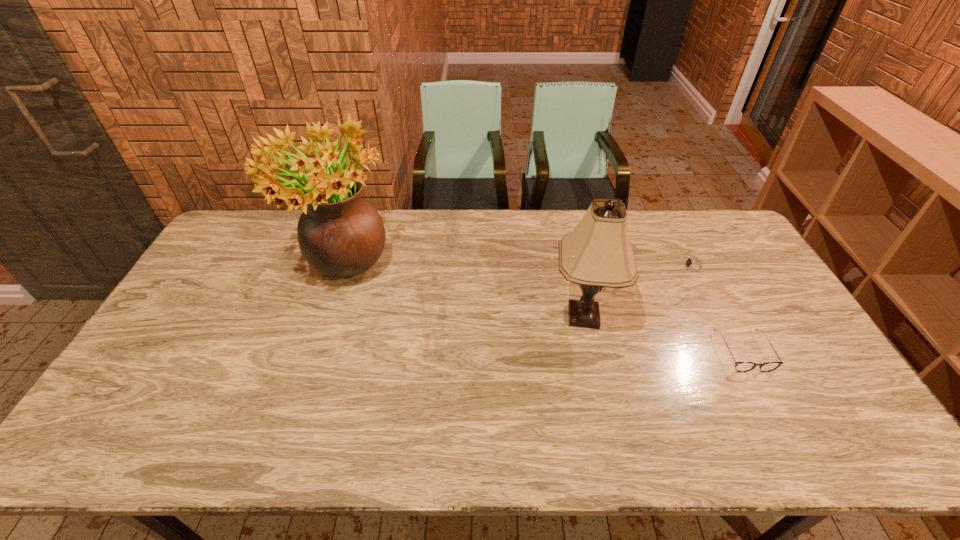
Locate an element on the screen. vacant space that satisfies the following two spatial constraints: 1. on the face of the watch; 2. on the front side of the flower arrangement is located at coordinates (697, 272).

Image resolution: width=960 pixels, height=540 pixels. I want to click on vacant region that satisfies the following two spatial constraints: 1. on the face of the watch; 2. on the front side of the leftmost object, so click(x=697, y=272).